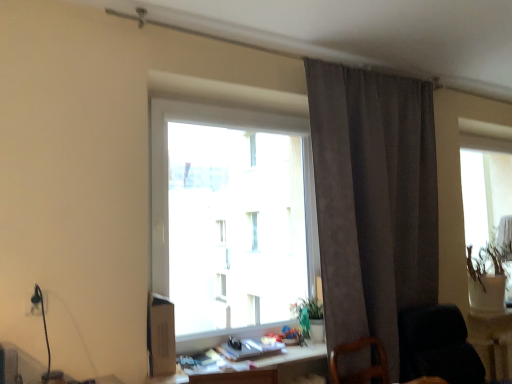
Question: From the image's perspective, would you say wooden table at lower right, which is the second table in top-to-bottom order, is positioned over transparent glass window at center?

Choices:
 (A) no
 (B) yes

Answer: (A)

Question: From the image's perspective, is wooden table at lower right, which is the second table in left-to-right order, under transparent glass window at center?

Choices:
 (A) no
 (B) yes

Answer: (B)

Question: From a real-world perspective, is wooden table at lower right, the second table in the front-to-back sequence, beneath transparent glass window at center?

Choices:
 (A) no
 (B) yes

Answer: (B)

Question: Does wooden table at lower right, the 1th table when ordered from back to front, turn towards transparent glass window at center?

Choices:
 (A) no
 (B) yes

Answer: (A)

Question: Considering the relative sizes of wooden table at lower right, which is the second table in left-to-right order, and transparent glass window at center in the image provided, is wooden table at lower right, which is the second table in left-to-right order, smaller than transparent glass window at center?

Choices:
 (A) no
 (B) yes

Answer: (B)

Question: In terms of width, does suede-like gray curtain at upper right look wider or thinner when compared to green matte vase at right?

Choices:
 (A) thin
 (B) wide

Answer: (A)

Question: From the image's perspective, is suede-like gray curtain at upper right above or below green matte vase at right?

Choices:
 (A) below
 (B) above

Answer: (B)

Question: In terms of height, does suede-like gray curtain at upper right look taller or shorter compared to green matte vase at right?

Choices:
 (A) tall
 (B) short

Answer: (A)

Question: Relative to green matte vase at right, is suede-like gray curtain at upper right in front or behind?

Choices:
 (A) behind
 (B) front

Answer: (B)

Question: From a real-world perspective, relative to suede-like gray curtain at upper right, is wooden table at lower right, the second table in the front-to-back sequence, vertically above or below?

Choices:
 (A) above
 (B) below

Answer: (B)

Question: Is wooden table at lower right, marked as the first table in a right-to-left arrangement, in front of or behind suede-like gray curtain at upper right in the image?

Choices:
 (A) behind
 (B) front

Answer: (A)

Question: In terms of width, does wooden table at lower right, which is the second table in top-to-bottom order, look wider or thinner when compared to suede-like gray curtain at upper right?

Choices:
 (A) thin
 (B) wide

Answer: (A)

Question: Is point (499, 377) positioned closer to the camera than point (410, 243)?

Choices:
 (A) closer
 (B) farther

Answer: (B)

Question: Is black fabric rocking chair at lower right inside or outside of wooden desk at lower center, which is the 1th table in top-to-bottom order?

Choices:
 (A) inside
 (B) outside

Answer: (B)

Question: From the image's perspective, is black fabric rocking chair at lower right located above or below wooden desk at lower center, marked as the 2th table in a back-to-front arrangement?

Choices:
 (A) below
 (B) above

Answer: (A)